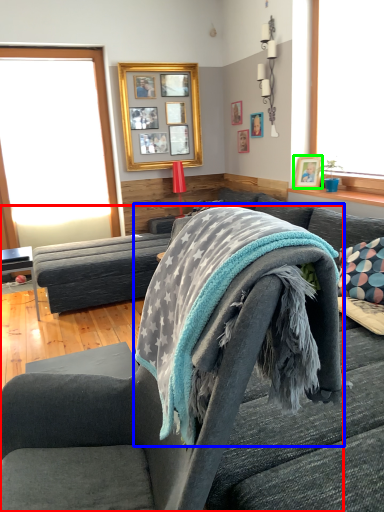
Question: Which object is positioned closest to chair (highlighted by a red box)? Select from bath towel (highlighted by a blue box) and picture frame (highlighted by a green box).

Choices:
 (A) bath towel
 (B) picture frame

Answer: (A)